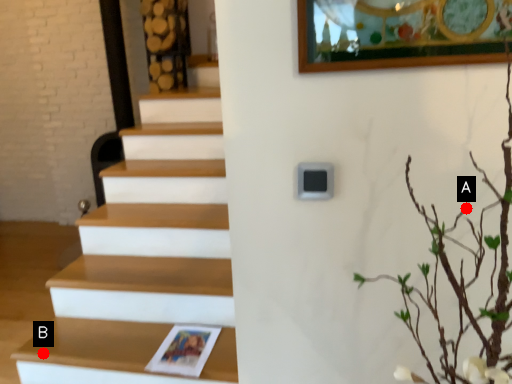
Question: Two points are circled on the image, labeled by A and B beside each circle. Which point is farther from the camera taking this photo?

Choices:
 (A) A is further
 (B) B is further

Answer: (B)